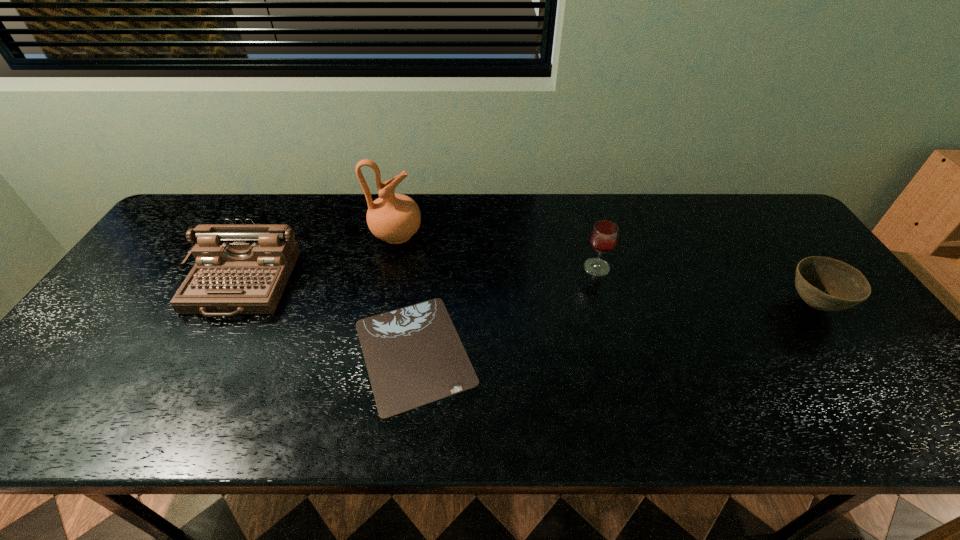
This screenshot has height=540, width=960. In order to click on vacant region that satisfies the following two spatial constraints: 1. on the keyboard of the rightmost object; 2. on the right side of the leftmost object in this screenshot , I will do (230, 305).

Find the location of `blank area in the image that satisfies the following two spatial constraints: 1. on the spout of the shortest object; 2. on the right side of the tallest object`. blank area in the image that satisfies the following two spatial constraints: 1. on the spout of the shortest object; 2. on the right side of the tallest object is located at coordinates (372, 352).

The image size is (960, 540). What are the coordinates of `vacant space that satisfies the following two spatial constraints: 1. on the keyboard of the typewriter; 2. on the left side of the mousepad` in the screenshot? It's located at (204, 352).

I want to click on free space that satisfies the following two spatial constraints: 1. on the keyboard of the shortest object; 2. on the right side of the typewriter, so click(204, 352).

Find the location of a particular element. vacant position in the image that satisfies the following two spatial constraints: 1. on the spout of the tallest object; 2. on the keyboard of the leftmost object is located at coordinates (387, 284).